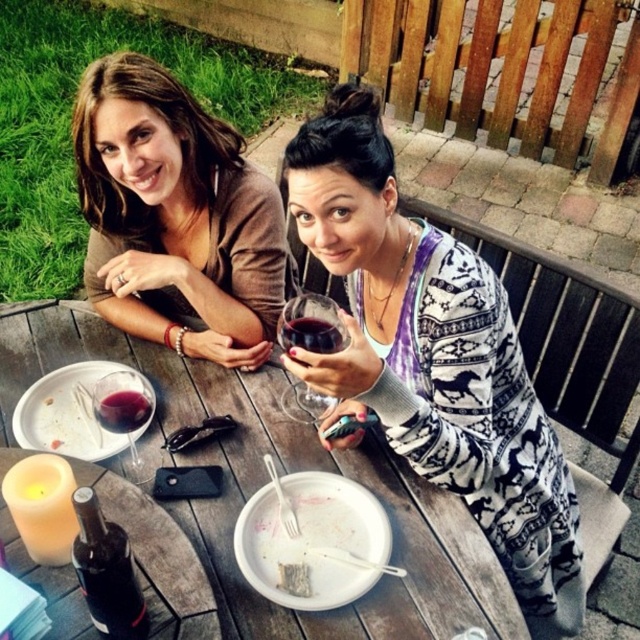
Question: Which of the following is the closest to the observer?

Choices:
 (A) (296, 564)
 (B) (292, 332)

Answer: (A)

Question: Which of the following is the farthest from the observer?

Choices:
 (A) dark brown glass bottle at lower left
 (B) matte brown sweater at upper left
 (C) wooden table at center

Answer: (B)

Question: Can you confirm if matte brown sweater at upper left is positioned below transparent glass wine glass at center?

Choices:
 (A) no
 (B) yes

Answer: (A)

Question: Can you confirm if wooden table at center is positioned to the left of dark red glass at upper center?

Choices:
 (A) no
 (B) yes

Answer: (B)

Question: From the image, what is the correct spatial relationship of white printed sweater at center in relation to white crumbly bread at lower center?

Choices:
 (A) left
 (B) right

Answer: (B)

Question: Which point is farther to the camera?

Choices:
 (A) [x=172, y=218]
 (B) [x=280, y=330]
 (C) [x=140, y=419]
 (D) [x=113, y=426]

Answer: (A)